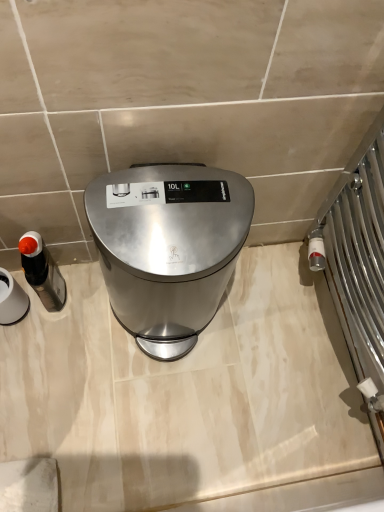
Question: Does matte black soap dispenser at left, positioned as the 2th appliance in left-to-right order, have a greater height compared to matte black soap dispenser at left, the 1th appliance in the left-to-right sequence?

Choices:
 (A) no
 (B) yes

Answer: (A)

Question: From a real-world perspective, is matte black soap dispenser at left, which appears as the first appliance when viewed from the right, positioned under matte black soap dispenser at left, which ranks as the second appliance in right-to-left order, based on gravity?

Choices:
 (A) no
 (B) yes

Answer: (B)

Question: Considering the relative positions of matte black soap dispenser at left, positioned as the 2th appliance in left-to-right order, and matte black soap dispenser at left, the 1th appliance in the left-to-right sequence, in the image provided, is matte black soap dispenser at left, positioned as the 2th appliance in left-to-right order, in front of matte black soap dispenser at left, the 1th appliance in the left-to-right sequence,?

Choices:
 (A) no
 (B) yes

Answer: (A)

Question: Can you confirm if matte black soap dispenser at left, which appears as the first appliance when viewed from the right, is thinner than matte black soap dispenser at left, the 1th appliance in the left-to-right sequence?

Choices:
 (A) no
 (B) yes

Answer: (B)

Question: Does matte black soap dispenser at left, positioned as the 2th appliance in left-to-right order, come behind matte black soap dispenser at left, the 1th appliance in the left-to-right sequence?

Choices:
 (A) yes
 (B) no

Answer: (A)

Question: Based on their sizes in the image, would you say matte black soap dispenser at left, which appears as the first appliance when viewed from the right, is bigger or smaller than satin silver trash can at center?

Choices:
 (A) big
 (B) small

Answer: (B)

Question: Considering their positions, is matte black soap dispenser at left, positioned as the 2th appliance in left-to-right order, located in front of or behind satin silver trash can at center?

Choices:
 (A) behind
 (B) front

Answer: (A)

Question: From their relative heights in the image, would you say matte black soap dispenser at left, which appears as the first appliance when viewed from the right, is taller or shorter than satin silver trash can at center?

Choices:
 (A) tall
 (B) short

Answer: (B)

Question: Based on their positions, is matte black soap dispenser at left, which appears as the first appliance when viewed from the right, located to the left or right of satin silver trash can at center?

Choices:
 (A) right
 (B) left

Answer: (B)

Question: From a real-world perspective, is satin silver trash can at center physically located above or below matte black soap dispenser at left, which ranks as the second appliance in right-to-left order?

Choices:
 (A) below
 (B) above

Answer: (B)

Question: Considering the positions of point (205, 301) and point (29, 304), is point (205, 301) closer or farther from the camera than point (29, 304)?

Choices:
 (A) farther
 (B) closer

Answer: (A)

Question: Looking at the image, does satin silver trash can at center seem bigger or smaller compared to matte black soap dispenser at left, which ranks as the second appliance in right-to-left order?

Choices:
 (A) small
 (B) big

Answer: (B)

Question: Visually, is satin silver trash can at center positioned to the left or to the right of matte black soap dispenser at left, the 1th appliance in the left-to-right sequence?

Choices:
 (A) right
 (B) left

Answer: (A)

Question: Is matte black soap dispenser at left, the 1th appliance in the left-to-right sequence, spatially inside matte black soap dispenser at left, positioned as the 2th appliance in left-to-right order, or outside of it?

Choices:
 (A) inside
 (B) outside

Answer: (B)

Question: Is matte black soap dispenser at left, which ranks as the second appliance in right-to-left order, in front of or behind matte black soap dispenser at left, positioned as the 2th appliance in left-to-right order, in the image?

Choices:
 (A) front
 (B) behind

Answer: (A)